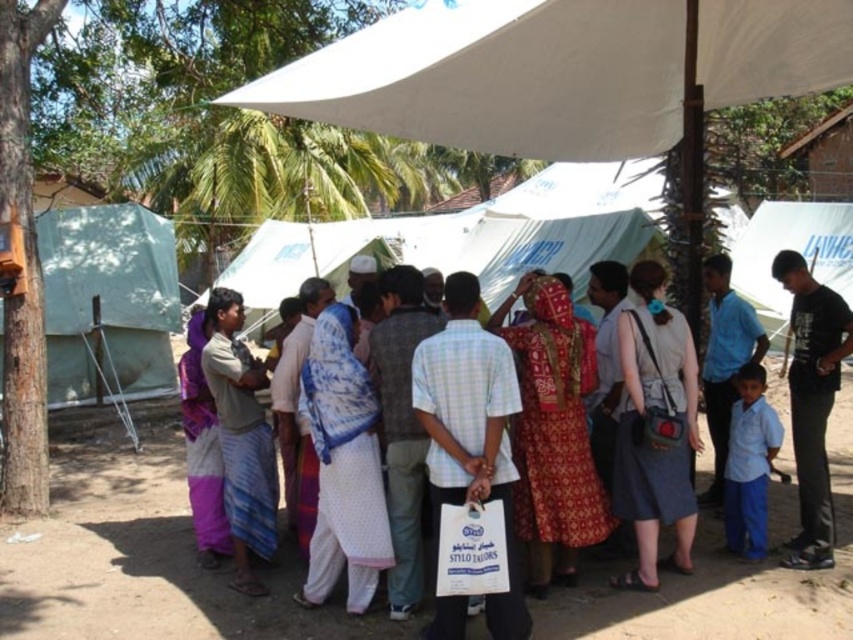
Question: Which object is farther from the camera taking this photo?

Choices:
 (A) white fabric canopy at upper center
 (B) light blue uniform at lower right
 (C) black cotton shirt at right
 (D) white dotted fabric at center

Answer: (B)

Question: Does red printed dress at center have a larger size compared to light blue uniform at lower right?

Choices:
 (A) yes
 (B) no

Answer: (A)

Question: Can you confirm if green tarpaulin tent at left is thinner than light blue uniform at lower right?

Choices:
 (A) no
 (B) yes

Answer: (A)

Question: Which object is closer to the camera taking this photo?

Choices:
 (A) white fabric tent at upper center
 (B) light gray fabric dress at center
 (C) light blue uniform at lower right
 (D) black cotton shirt at right

Answer: (B)

Question: Which point is closer to the camera?

Choices:
 (A) (45, 260)
 (B) (653, 342)
 (C) (509, 474)
 (D) (541, 282)

Answer: (C)

Question: Can you confirm if light blue checkered shirt at center is wider than light brown woven cloth at center?

Choices:
 (A) yes
 (B) no

Answer: (A)